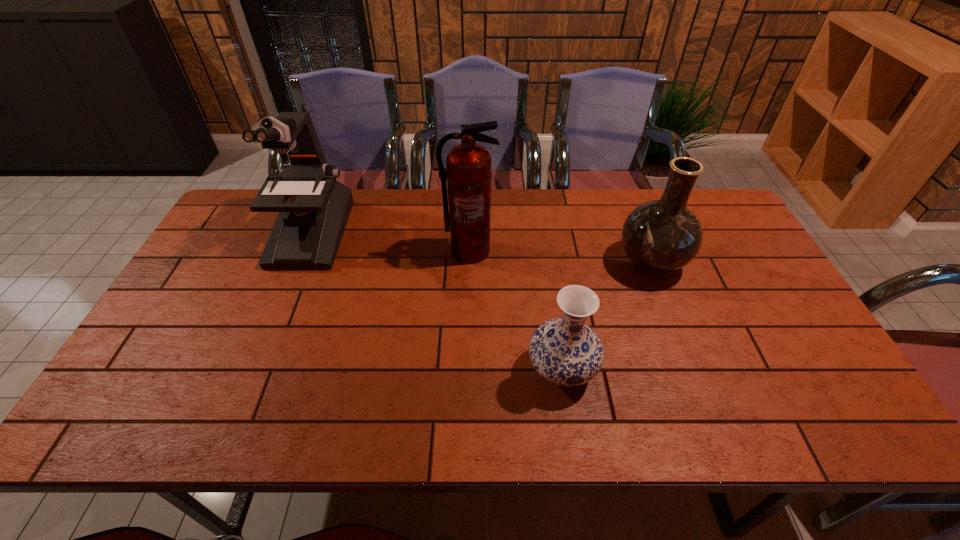
You are a GUI agent. You are given a task and a screenshot of the screen. Output one action in this format:
    pyautogui.click(x=<x>, y=<y>)
    Task: Click on the object that is at the far edge
    
    Given the screenshot: What is the action you would take?
    pyautogui.click(x=314, y=207)

I want to click on object present at the near edge, so click(565, 351).

The height and width of the screenshot is (540, 960). Find the location of `free space at the far edge`. free space at the far edge is located at coordinates (594, 218).

In order to click on vacant area at the near edge of the desktop in this screenshot , I will do `click(185, 426)`.

You are a GUI agent. You are given a task and a screenshot of the screen. Output one action in this format:
    pyautogui.click(x=<x>, y=<y>)
    Task: Click on the vacant space at the left edge of the desktop
    The height and width of the screenshot is (540, 960).
    Given the screenshot: What is the action you would take?
    (x=181, y=385)

Locate an element on the screen. Image resolution: width=960 pixels, height=540 pixels. free space at the right edge of the desktop is located at coordinates (805, 383).

This screenshot has width=960, height=540. In the image, there is a desktop. Find the location of `blank space at the far left corner`. blank space at the far left corner is located at coordinates (247, 212).

Where is `empty location between the microscope and the second object from right to left`? Image resolution: width=960 pixels, height=540 pixels. empty location between the microscope and the second object from right to left is located at coordinates (436, 301).

This screenshot has height=540, width=960. What are the coordinates of `unoccupied position between the fire extinguisher and the leftmost object` in the screenshot? It's located at (390, 242).

Identify the location of vacant point located between the leftmost object and the nearer vase. This screenshot has width=960, height=540. (436, 301).